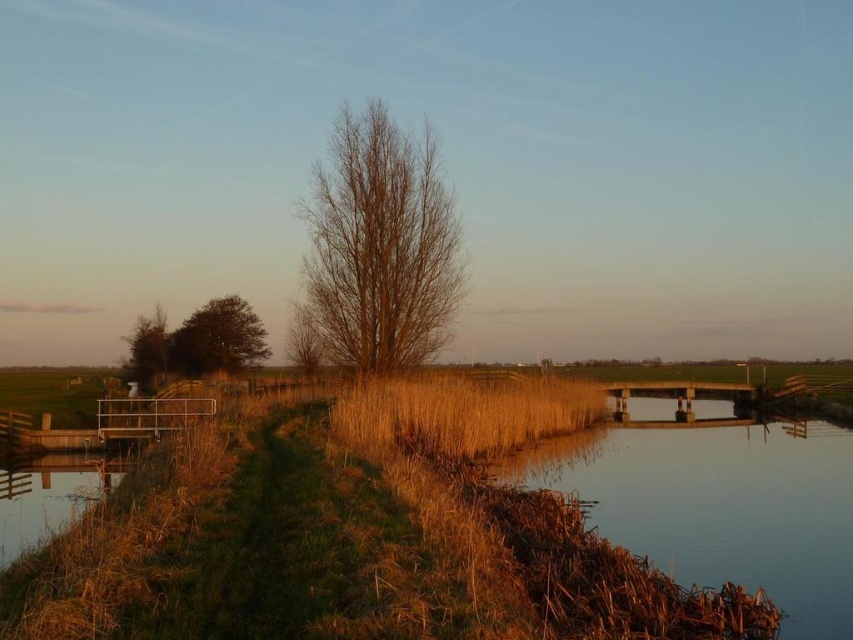
Question: Which of the following is the closest to the observer?

Choices:
 (A) (252, 339)
 (B) (386, 419)
 (C) (132, 358)

Answer: (B)

Question: Is brown grassy river at lower right wider than smooth concrete bridge at lower left?

Choices:
 (A) yes
 (B) no

Answer: (A)

Question: Observing the image, what is the correct spatial positioning of bare wood tree at center in reference to smooth concrete bridge at lower left?

Choices:
 (A) right
 (B) left

Answer: (A)

Question: Does bare wood tree at center have a lesser width compared to brown matte tree at left?

Choices:
 (A) no
 (B) yes

Answer: (B)

Question: Which object is the farthest from the smooth concrete bridge at lower left?

Choices:
 (A) green matte tree at left
 (B) bare wood tree at center
 (C) brown matte tree at left
 (D) brown grassy river at lower right

Answer: (C)

Question: Among these points, which one is nearest to the camera?

Choices:
 (A) (154, 317)
 (B) (369, 364)
 (C) (556, 492)
 (D) (0, 524)

Answer: (D)